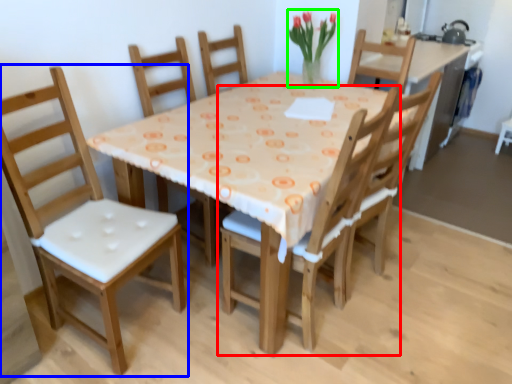
Question: Which object is positioned farthest from chair (highlighted by a red box)? Select from chair (highlighted by a blue box) and floral arrangement (highlighted by a green box).

Choices:
 (A) chair
 (B) floral arrangement

Answer: (B)